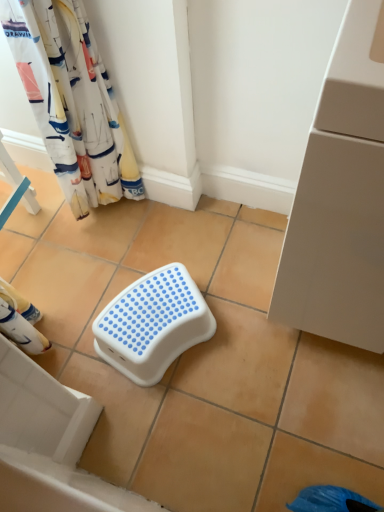
You are a GUI agent. You are given a task and a screenshot of the screen. Output one action in this format:
    pyautogui.click(x=<x>, y=<y>)
    Task: Click on the vacant area that is in front of white plastic step stool at center
    Image resolution: width=384 pixels, height=512 pixels.
    Given the screenshot: What is the action you would take?
    pyautogui.click(x=179, y=423)